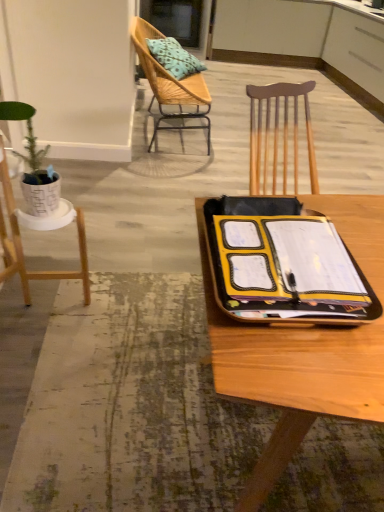
Where is `green matte plant pot at left`? The image size is (384, 512). green matte plant pot at left is located at coordinates [34, 164].

Identify the location of yellow fabric binder at center. The height and width of the screenshot is (512, 384). (291, 374).

Locate an element on the screen. The height and width of the screenshot is (512, 384). white matte plant stand at left, acting as the first chair starting from the bottom is located at coordinates (40, 230).

Considering the relative sizes of yellow matte notebook at center and blue patterned cushion at upper center in the image provided, is yellow matte notebook at center wider than blue patterned cushion at upper center?

In fact, yellow matte notebook at center might be narrower than blue patterned cushion at upper center.

Which of these two, yellow matte notebook at center or blue patterned cushion at upper center, stands shorter?

Standing shorter between the two is yellow matte notebook at center.

In the image, is yellow matte notebook at center positioned in front of or behind blue patterned cushion at upper center?

yellow matte notebook at center is in front of blue patterned cushion at upper center.

From a real-world perspective, is yellow matte notebook at center physically above woven wood chair at upper left, which is the first chair in top-to-bottom order?

Indeed, from a real-world perspective, yellow matte notebook at center stands above woven wood chair at upper left, which is the first chair in top-to-bottom order.

Between yellow matte notebook at center and woven wood chair at upper left, the 1th chair positioned from the back, which one has smaller width?

yellow matte notebook at center.

Is yellow matte notebook at center positioned behind woven wood chair at upper left, the 1th chair positioned from the back?

No, the depth of yellow matte notebook at center is less than that of woven wood chair at upper left, the 1th chair positioned from the back.

Is yellow matte notebook at center at the right side of woven wood chair at upper left, which is counted as the second chair, starting from the front?

Indeed, yellow matte notebook at center is positioned on the right side of woven wood chair at upper left, which is counted as the second chair, starting from the front.

Considering the points (185, 68) and (292, 289), which point is behind, point (185, 68) or point (292, 289)?

The point (185, 68) is behind.

Looking at this image, is blue patterned cushion at upper center to the right of yellow matte notebook at center from the viewer's perspective?

In fact, blue patterned cushion at upper center is to the left of yellow matte notebook at center.

Is blue patterned cushion at upper center beside yellow matte notebook at center?

Result: No, blue patterned cushion at upper center is not making contact with yellow matte notebook at center.

Which is in front, blue patterned cushion at upper center or yellow matte notebook at center?

yellow matte notebook at center.

Does point (116, 413) appear closer or farther from the camera than point (48, 195)?

Clearly, point (116, 413) is closer to the camera than point (48, 195).

Which is more to the left, yellow fabric binder at lower right or green matte plant pot at left?

green matte plant pot at left.

Is yellow fabric binder at lower right far away from green matte plant pot at left?

No.

Can green matte plant pot at left be found inside yellow fabric binder at lower right?

No, green matte plant pot at left is not surrounded by yellow fabric binder at lower right.

Can you confirm if woven wood chair at upper left, the 1th chair positioned from the back, is taller than yellow fabric binder at center?

Yes, woven wood chair at upper left, the 1th chair positioned from the back, is taller than yellow fabric binder at center.

Can you confirm if woven wood chair at upper left, which is counted as the second chair, starting from the front, is wider than yellow fabric binder at center?

Incorrect, the width of woven wood chair at upper left, which is counted as the second chair, starting from the front, does not surpass that of yellow fabric binder at center.

Based on the photo, from the image's perspective, which one is positioned lower, woven wood chair at upper left, the second chair from the bottom, or yellow fabric binder at center?

yellow fabric binder at center.

From the picture: Is woven wood chair at upper left, the second chair from the bottom, facing towards yellow fabric binder at center?

No, woven wood chair at upper left, the second chair from the bottom, is not oriented towards yellow fabric binder at center.

Is there a large distance between yellow matte notebook at center and yellow fabric binder at lower right?

They are positioned close to each other.

Between yellow matte notebook at center and yellow fabric binder at lower right, which one has less height?

yellow fabric binder at lower right.

Which object is thinner, yellow matte notebook at center or yellow fabric binder at lower right?

yellow matte notebook at center.

Can you confirm if green matte plant pot at left is thinner than yellow fabric binder at lower right?

Indeed, green matte plant pot at left has a lesser width compared to yellow fabric binder at lower right.

How far apart are green matte plant pot at left and yellow fabric binder at lower right?

green matte plant pot at left is 32.40 inches away from yellow fabric binder at lower right.

Are green matte plant pot at left and yellow fabric binder at lower right beside each other?

No, green matte plant pot at left is not touching yellow fabric binder at lower right.

Who is taller, green matte plant pot at left or yellow fabric binder at lower right?

With more height is green matte plant pot at left.

Where is `notebook in front of the blue patterned cushion at upper center`? The height and width of the screenshot is (512, 384). notebook in front of the blue patterned cushion at upper center is located at coordinates (287, 260).

The height and width of the screenshot is (512, 384). I want to click on notebook positioned vertically above the woven wood chair at upper left, which is the first chair in top-to-bottom order (from a real-world perspective), so click(287, 260).

From the image, which object appears to be nearer to woven wood chair at upper left, which is counted as the second chair, starting from the front, yellow fabric binder at center or white matte plant stand at left, acting as the first chair starting from the bottom?

The object closer to woven wood chair at upper left, which is counted as the second chair, starting from the front, is white matte plant stand at left, acting as the first chair starting from the bottom.

Considering their positions, is yellow fabric binder at lower right positioned closer to green matte plant pot at left than woven wood chair at upper left, the 1th chair positioned from the back?

Based on the image, yellow fabric binder at lower right appears to be nearer to green matte plant pot at left.

Considering their positions, is yellow fabric binder at lower right positioned closer to white matte plant stand at left, which is counted as the second chair, starting from the top, than yellow matte notebook at center?

yellow fabric binder at lower right lies closer to white matte plant stand at left, which is counted as the second chair, starting from the top, than the other object.

Looking at the image, which one is located closer to yellow fabric binder at center, yellow fabric binder at lower right or blue patterned cushion at upper center?

yellow fabric binder at lower right lies closer to yellow fabric binder at center than the other object.

Estimate the real-world distances between objects in this image. Which object is further from green matte plant pot at left, yellow matte notebook at center or blue patterned cushion at upper center?

blue patterned cushion at upper center lies further to green matte plant pot at left than the other object.

Considering their positions, is green matte plant pot at left positioned further to yellow fabric binder at lower right than white matte plant stand at left, acting as the first chair starting from the bottom?

green matte plant pot at left is positioned further to the anchor yellow fabric binder at lower right.

Looking at the image, which one is located further to yellow fabric binder at lower right, green matte plant pot at left or yellow matte notebook at center?

Based on the image, yellow matte notebook at center appears to be further to yellow fabric binder at lower right.

Considering their positions, is green matte plant pot at left positioned closer to blue patterned cushion at upper center than yellow fabric binder at lower right?

Based on the image, green matte plant pot at left appears to be nearer to blue patterned cushion at upper center.

The image size is (384, 512). Find the location of `chair located between green matte plant pot at left and blue patterned cushion at upper center in the depth direction`. chair located between green matte plant pot at left and blue patterned cushion at upper center in the depth direction is located at coordinates (170, 84).

Where is `chair that lies between woven wood chair at upper left, which is counted as the second chair, starting from the front, and yellow fabric binder at lower right from top to bottom`? This screenshot has width=384, height=512. chair that lies between woven wood chair at upper left, which is counted as the second chair, starting from the front, and yellow fabric binder at lower right from top to bottom is located at coordinates (40, 230).

The width and height of the screenshot is (384, 512). Identify the location of chair between yellow fabric binder at center and woven wood chair at upper left, the 1th chair positioned from the back, from front to back. (40, 230).

The width and height of the screenshot is (384, 512). I want to click on desk between woven wood chair at upper left, the 1th chair positioned from the back, and yellow fabric binder at lower right, in the vertical direction, so click(x=291, y=374).